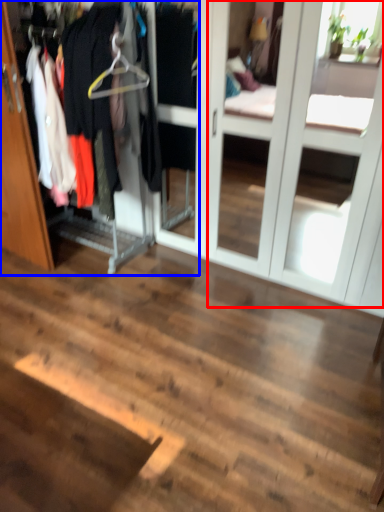
Question: Among these objects, which one is farthest to the camera, screen door (highlighted by a red box) or closet (highlighted by a blue box)?

Choices:
 (A) screen door
 (B) closet

Answer: (B)